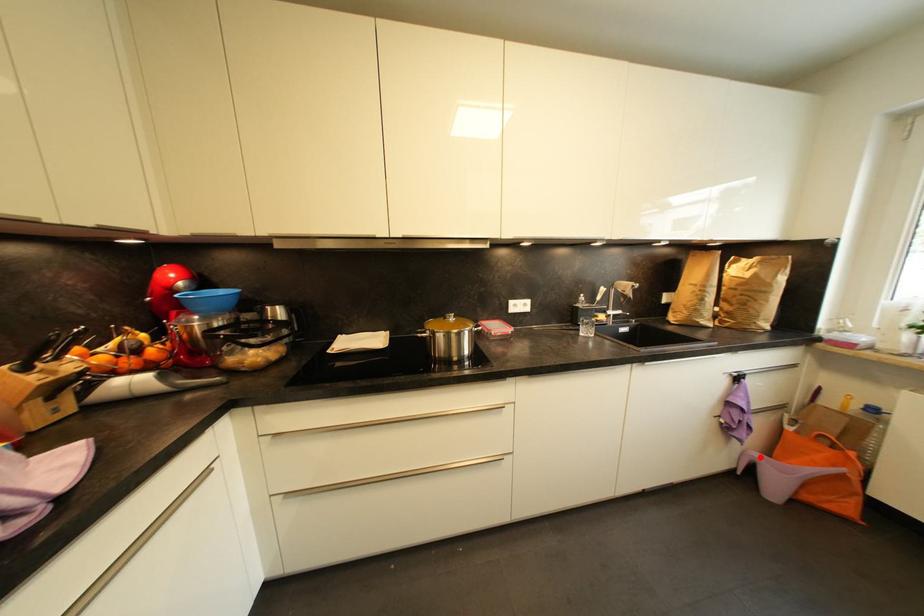
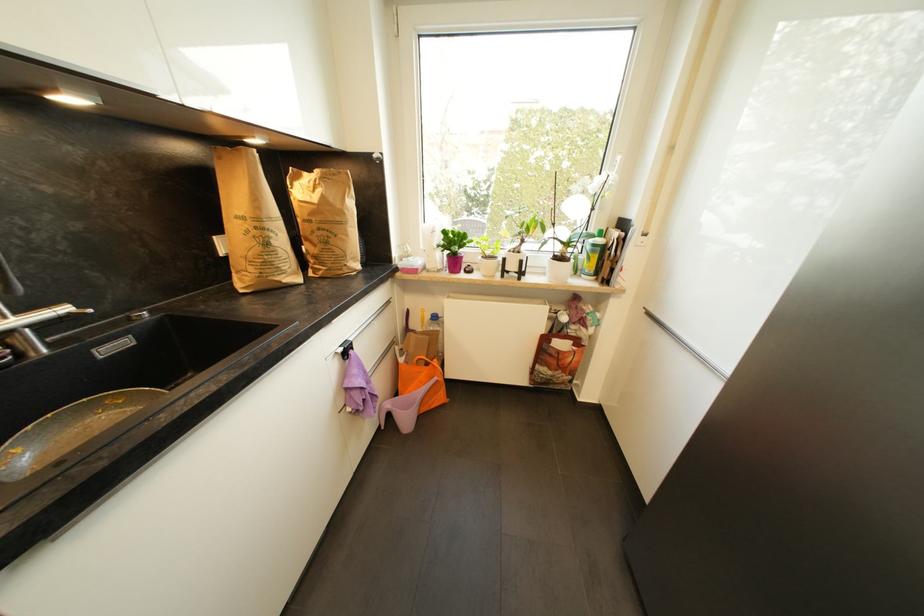
Question: A red point is marked in image1. In image2, is the corresponding 3D point closer to the camera or farther? Reply with the corresponding letter.

Choices:
 (A) The corresponding 3D point is closer.
 (B) The corresponding 3D point is farther.

Answer: (A)